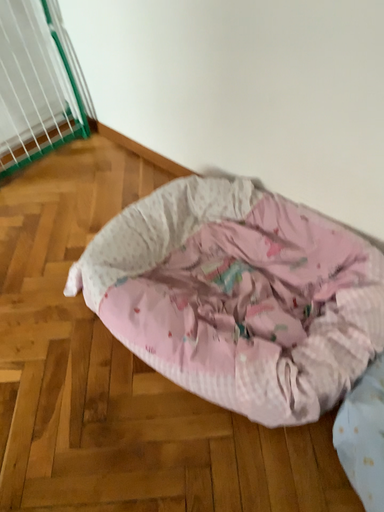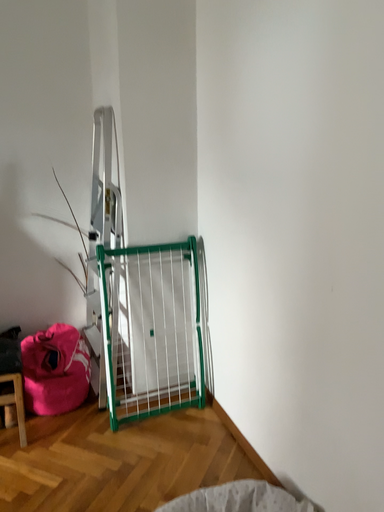
Question: How did the camera likely rotate when shooting the video?

Choices:
 (A) rotated left
 (B) rotated right

Answer: (A)